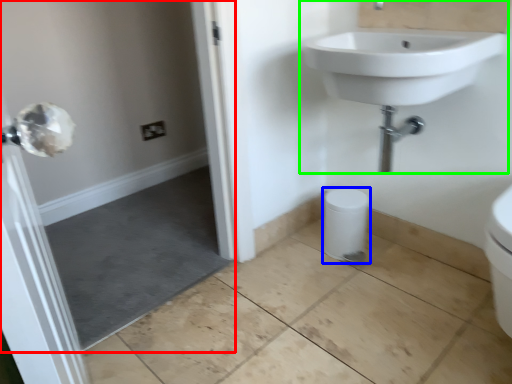
Question: Estimate the real-world distances between objects in this image. Which object is closer to screen door (highlighted by a red box), bidet (highlighted by a blue box) or sink (highlighted by a green box)?

Choices:
 (A) bidet
 (B) sink

Answer: (A)